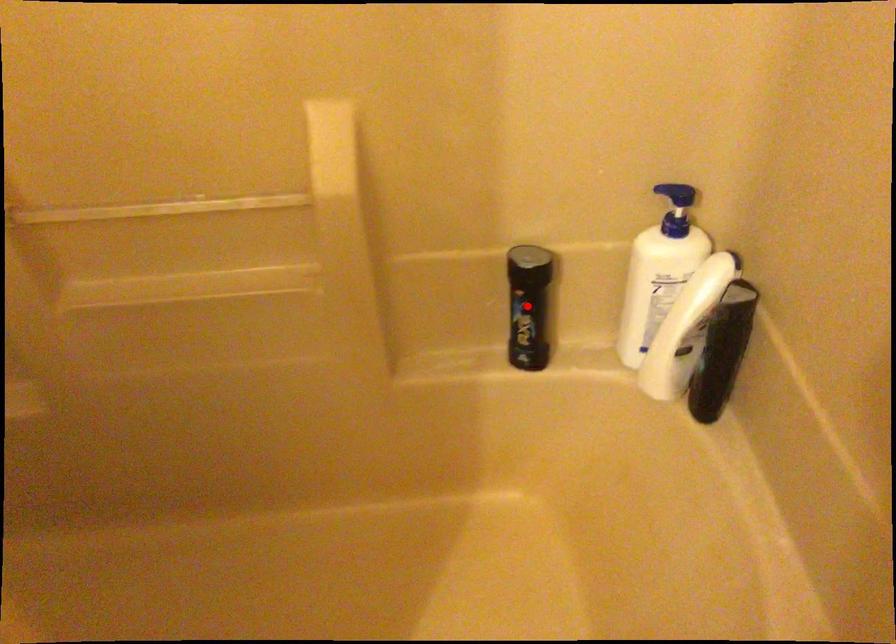
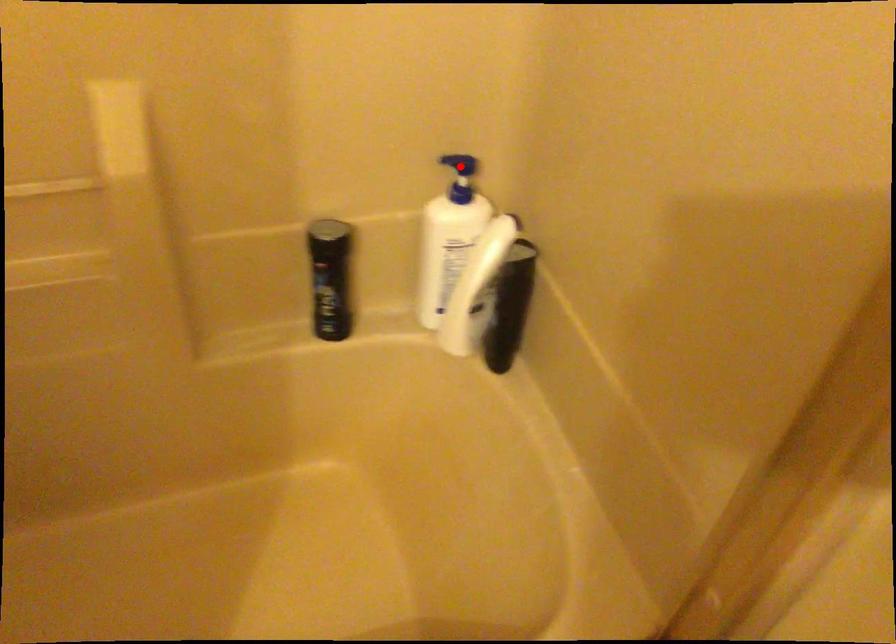
I am providing you with two images of the same scene from different viewpoints. A red point is marked on the first image and another point is marked on the second image. Is the marked point in image1 the same physical position as the marked point in image2?

No